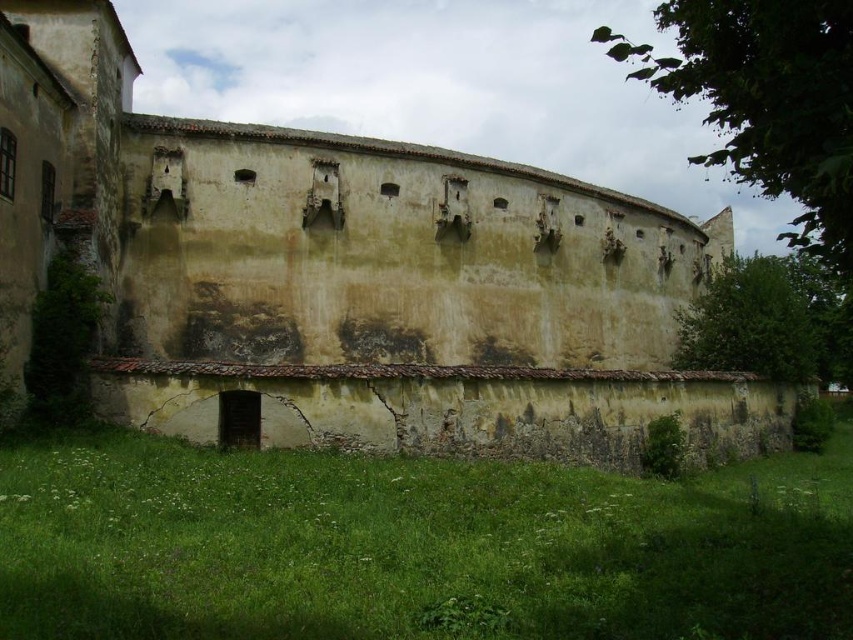
Is point (175, 173) positioned before point (581, 497)?

That is False.

What do you see at coordinates (347, 276) in the screenshot? This screenshot has width=853, height=640. I see `weathered stone wall at center` at bounding box center [347, 276].

I want to click on weathered stone wall at center, so point(347,276).